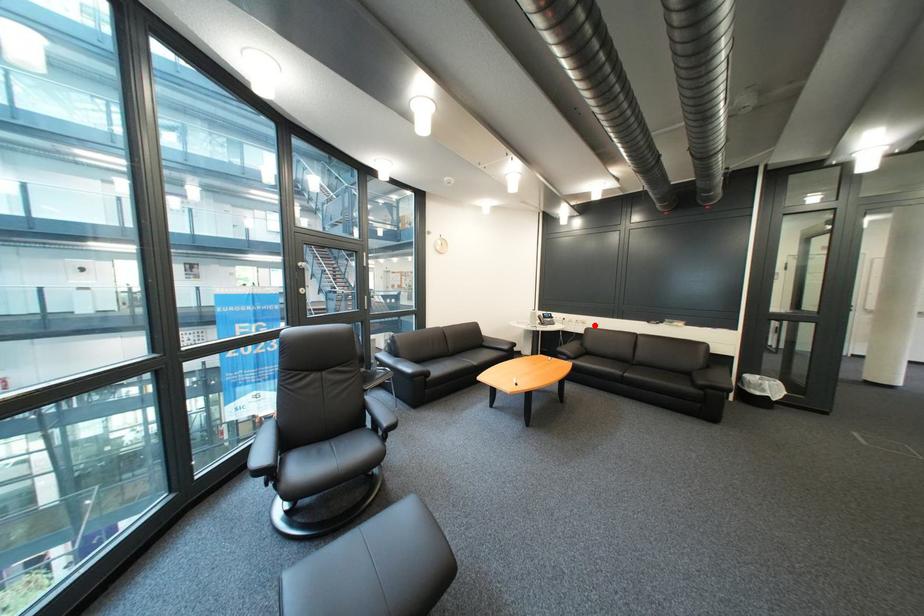
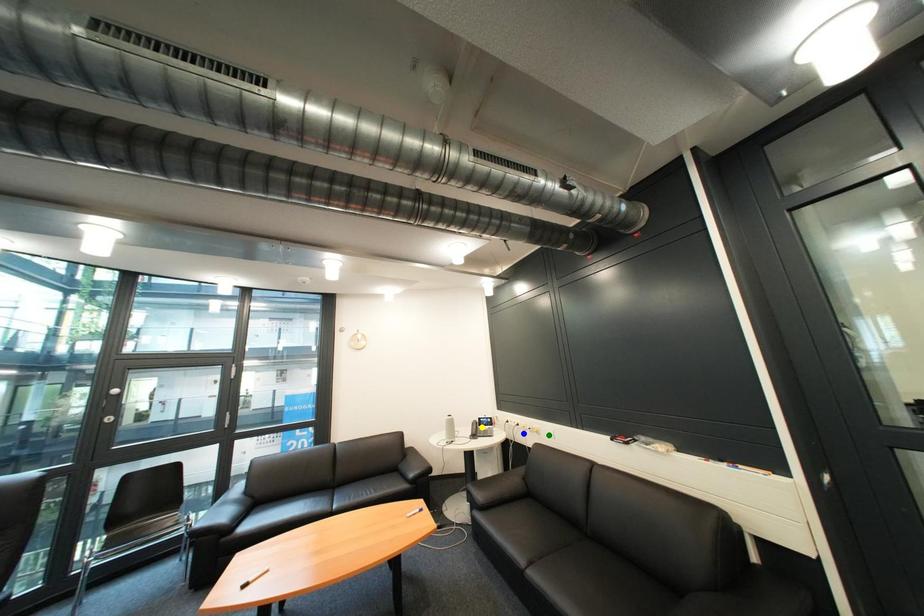
Question: I am providing you with two images of the same scene from different viewpoints. A red point is marked on the first image. You are given multiple points on the second image. In image 2, which mark is for the same physical point as the one in image 1?

Choices:
 (A) yellow point
 (B) blue point
 (C) green point

Answer: (C)